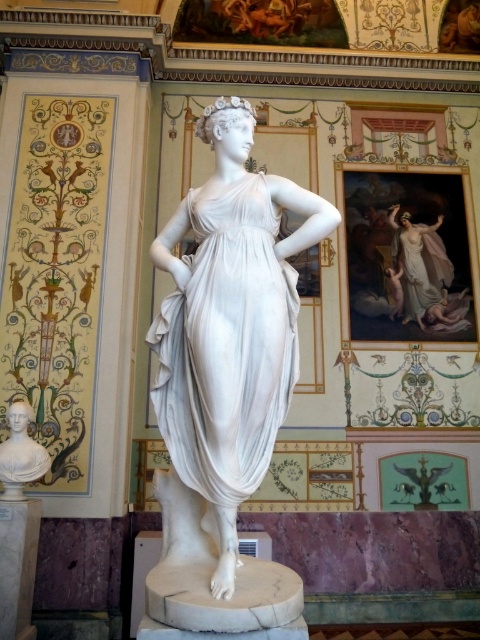
Does white marble statue at center lie in front of matte white bust at lower left?

Yes, it is in front of matte white bust at lower left.

Which is above, white marble statue at center or matte white bust at lower left?

white marble statue at center is above.

In the scene shown: Who is more forward, (x=249, y=417) or (x=29, y=413)?

Positioned in front is point (x=249, y=417).

Where is `white marble statue at center`? Image resolution: width=480 pixels, height=640 pixels. white marble statue at center is located at coordinates (229, 324).

Is white marble statue at center positioned at the back of white marble pillar at lower left?

That is False.

Is point (264, 250) closer to camera compared to point (22, 547)?

Yes, it is.

Identify the location of white marble statue at center. (229, 324).

Find the location of a particular element. The height and width of the screenshot is (640, 480). white marble statue at center is located at coordinates (229, 324).

Does white marble pillar at lower left appear over matte white bust at lower left?

Incorrect, white marble pillar at lower left is not positioned above matte white bust at lower left.

Which is behind, point (29, 577) or point (44, 461)?

Positioned behind is point (44, 461).

Is point (10, 552) positioned in front of point (15, 410)?

Yes, point (10, 552) is closer to viewer.

This screenshot has width=480, height=640. What are the coordinates of `white marble pillar at lower left` in the screenshot? It's located at (17, 566).